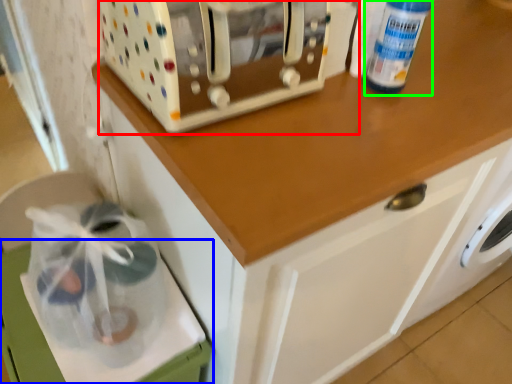
Question: Based on their relative distances, which object is farther from home appliance (highlighted by a red box)? Choose from cabinetry (highlighted by a blue box) and bottle (highlighted by a green box).

Choices:
 (A) cabinetry
 (B) bottle

Answer: (A)